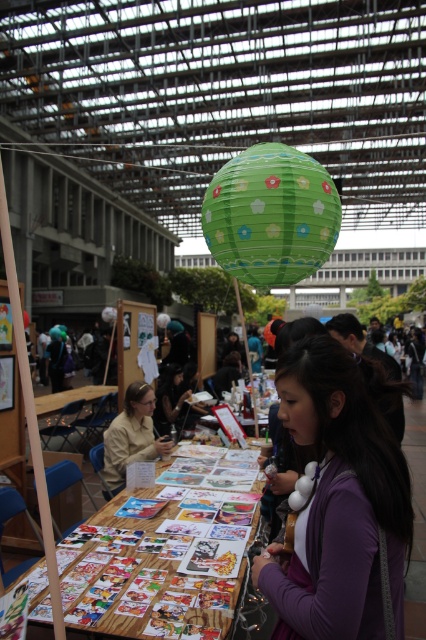
You are at an event and see both the printed paper cards at center and the green paper lantern at center. Which object is shorter?

The printed paper cards at center are shorter than the green paper lantern at center.

You are at an event and need to hang a small decoration that requires a support taller than 1 meter. You see the purple matte jacket at center and the green paper lantern at center. Which object can provide the necessary support?

The purple matte jacket at center is taller than the green paper lantern at center, so it can provide the necessary support for the decoration requiring a support taller than 1 meter.